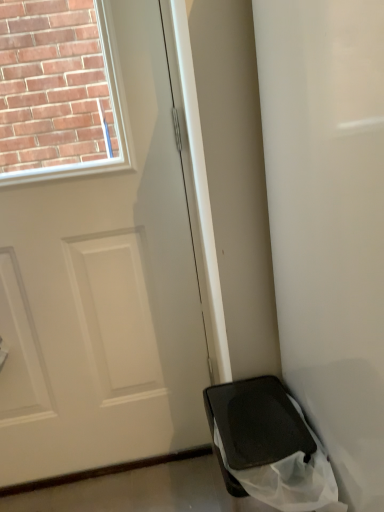
Question: Is black matte trash can at lower right turned away from black matte bag at lower right?

Choices:
 (A) yes
 (B) no

Answer: (B)

Question: Is black matte trash can at lower right surrounding black matte bag at lower right?

Choices:
 (A) no
 (B) yes

Answer: (A)

Question: Considering the relative sizes of black matte trash can at lower right and black matte bag at lower right in the image provided, is black matte trash can at lower right thinner than black matte bag at lower right?

Choices:
 (A) no
 (B) yes

Answer: (B)

Question: Considering the relative sizes of black matte trash can at lower right and black matte bag at lower right in the image provided, is black matte trash can at lower right taller than black matte bag at lower right?

Choices:
 (A) no
 (B) yes

Answer: (A)

Question: From the image's perspective, is black matte trash can at lower right on top of black matte bag at lower right?

Choices:
 (A) no
 (B) yes

Answer: (A)

Question: Considering the relative sizes of black matte trash can at lower right and black matte bag at lower right in the image provided, is black matte trash can at lower right shorter than black matte bag at lower right?

Choices:
 (A) yes
 (B) no

Answer: (A)

Question: Are black matte bag at lower right and white matte door at center making contact?

Choices:
 (A) no
 (B) yes

Answer: (A)

Question: From the image's perspective, would you say black matte bag at lower right is shown under white matte door at center?

Choices:
 (A) no
 (B) yes

Answer: (B)

Question: Is black matte bag at lower right wider than white matte door at center?

Choices:
 (A) yes
 (B) no

Answer: (A)

Question: Considering the relative sizes of black matte bag at lower right and white matte door at center in the image provided, is black matte bag at lower right taller than white matte door at center?

Choices:
 (A) yes
 (B) no

Answer: (B)

Question: Is black matte bag at lower right facing away from white matte door at center?

Choices:
 (A) no
 (B) yes

Answer: (A)

Question: Could you tell me if black matte bag at lower right is turned towards white matte door at center?

Choices:
 (A) yes
 (B) no

Answer: (B)

Question: Considering the relative sizes of black matte bag at lower right and black matte trash can at lower right in the image provided, is black matte bag at lower right smaller than black matte trash can at lower right?

Choices:
 (A) yes
 (B) no

Answer: (B)